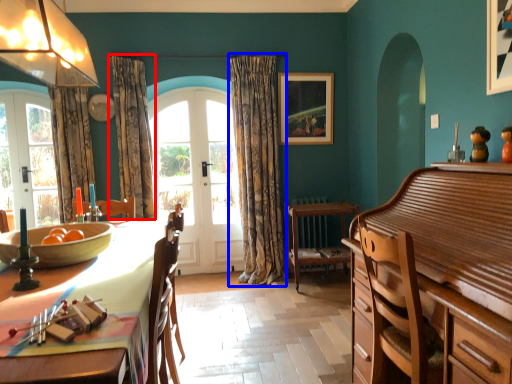
Question: Which object is further to the camera taking this photo, curtain (highlighted by a red box) or curtain (highlighted by a blue box)?

Choices:
 (A) curtain
 (B) curtain

Answer: (B)